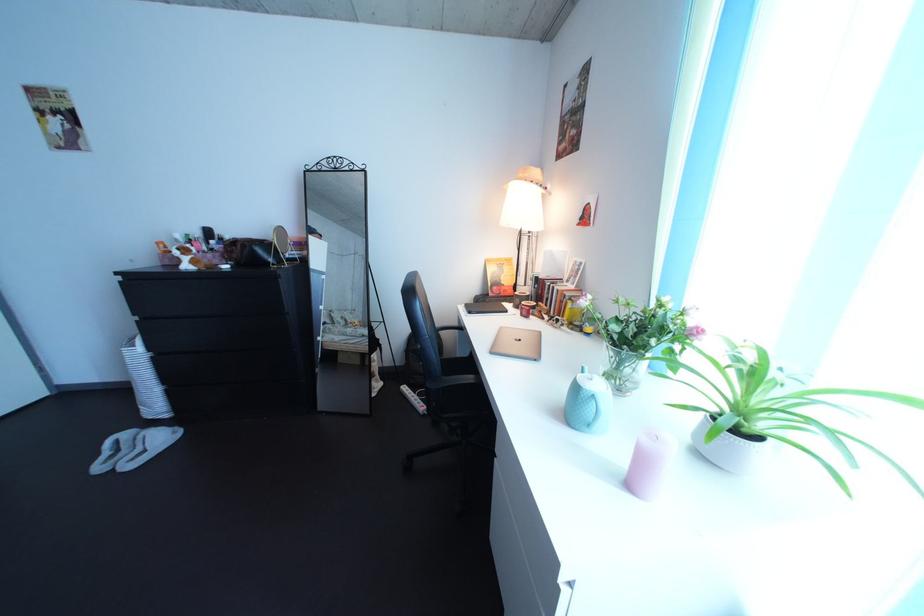
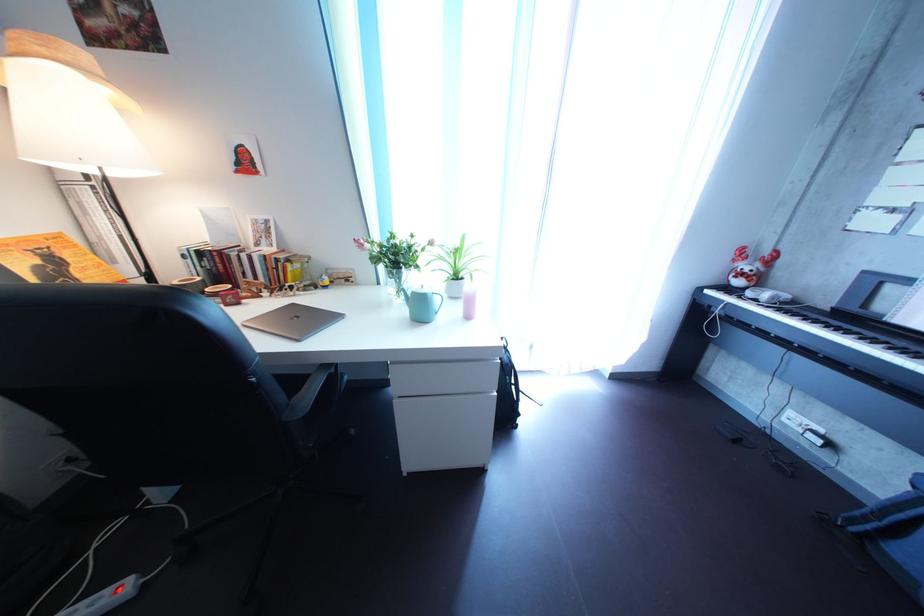
First-person continuous shooting, in which direction is the camera rotating?

The camera rotated toward right-down.